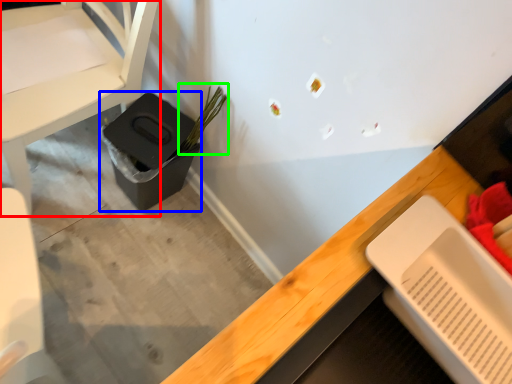
Question: Which object is the closest to the chair (highlighted by a red box)? Choose among these: potty (highlighted by a blue box) or plant (highlighted by a green box).

Choices:
 (A) potty
 (B) plant

Answer: (A)